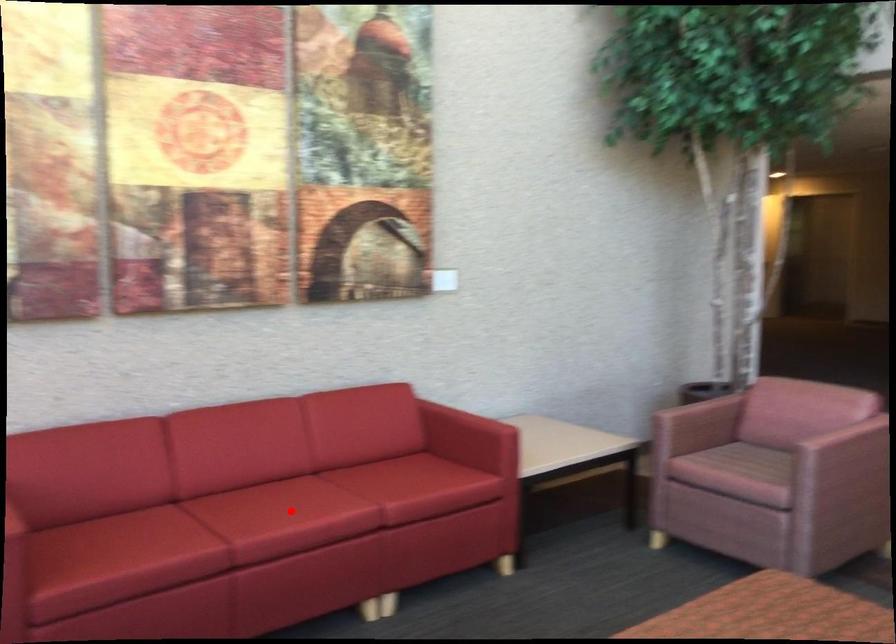
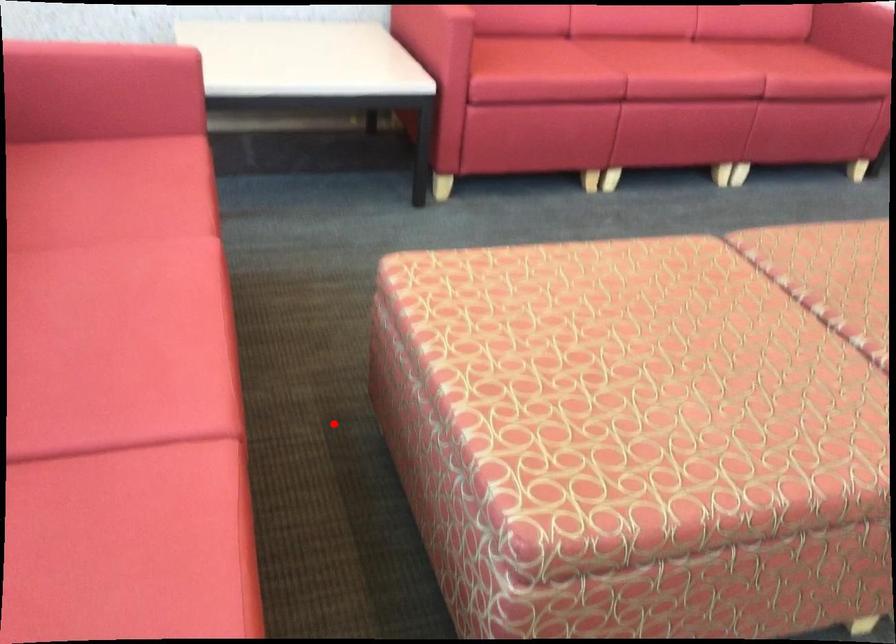
I am providing you with two images of the same scene from different viewpoints. A red point is marked on the first image and another point is marked on the second image. Does the point marked in image1 correspond to the same location as the one in image2?

No